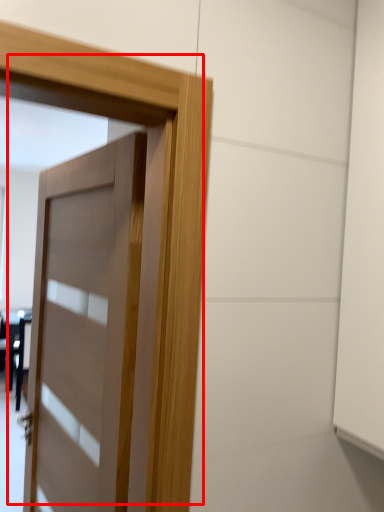
Question: Where is door (annotated by the red box) located in relation to table in the image?

Choices:
 (A) left
 (B) right

Answer: (B)